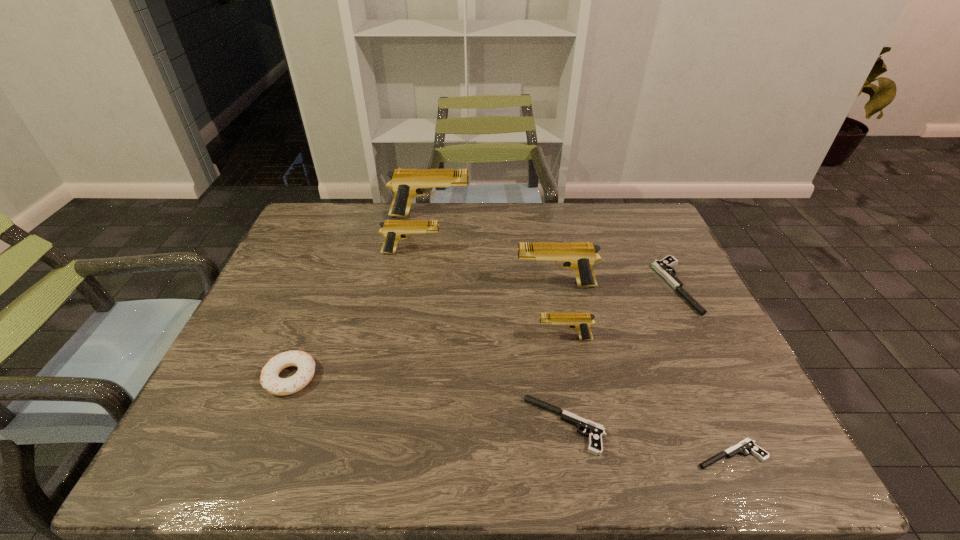
Find the location of a particular element. vacant space at the right edge is located at coordinates (672, 249).

This screenshot has height=540, width=960. What are the coordinates of `free space at the far left corner of the desktop` in the screenshot? It's located at (329, 214).

In the image, there is a desktop. Where is `vacant space at the near left corner`? The image size is (960, 540). vacant space at the near left corner is located at coordinates (193, 438).

At what (x,y) coordinates should I click in order to perform the action: click on vacant space at the far right corner of the desktop. Please return your answer as a coordinate pair (x, y). This screenshot has height=540, width=960. Looking at the image, I should click on (604, 209).

This screenshot has height=540, width=960. In order to click on free space that is in between the leftmost object and the third shortest object in this screenshot , I will do `click(483, 332)`.

Where is `free point between the white doughnut and the third shortest pistol`? The width and height of the screenshot is (960, 540). free point between the white doughnut and the third shortest pistol is located at coordinates (483, 332).

This screenshot has width=960, height=540. I want to click on unoccupied area between the third tallest object and the leftmost object, so click(x=351, y=315).

This screenshot has width=960, height=540. Find the location of `unoccupied position between the nearest tan pistol and the shortest object`. unoccupied position between the nearest tan pistol and the shortest object is located at coordinates (647, 397).

Locate an element on the screen. The image size is (960, 540). empty space between the fourth nearest object and the doughnut is located at coordinates (427, 358).

Identify the location of vacant point located between the white doughnut and the fifth farthest object. This screenshot has width=960, height=540. (427, 358).